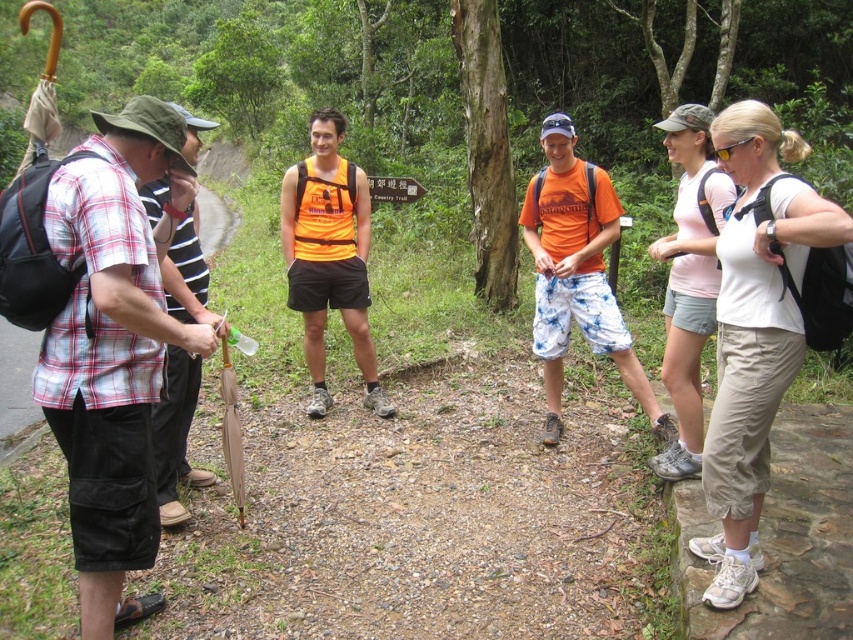
Which is more to the left, plaid cotton shirt at left or plaid fabric shirt at left?

plaid fabric shirt at left is more to the left.

Measure the distance from plaid cotton shirt at left to plaid fabric shirt at left.

29.06 inches

I want to click on plaid cotton shirt at left, so click(x=114, y=346).

This screenshot has width=853, height=640. In order to click on plaid cotton shirt at left in this screenshot , I will do `click(114, 346)`.

Locate an element on the screen. orange cotton shirt at center is located at coordinates (576, 273).

In the scene shown: Does orange cotton shirt at center appear on the left side of brown leather umbrella at lower left?

Incorrect, orange cotton shirt at center is not on the left side of brown leather umbrella at lower left.

Locate an element on the screen. This screenshot has height=640, width=853. orange cotton shirt at center is located at coordinates (576, 273).

Does orange cotton shirt at center have a larger size compared to pink fabric shorts at upper right?

Indeed, orange cotton shirt at center has a larger size compared to pink fabric shorts at upper right.

Can you confirm if orange cotton shirt at center is smaller than pink fabric shorts at upper right?

Actually, orange cotton shirt at center might be larger than pink fabric shorts at upper right.

Is point (550, 300) positioned behind point (706, 113)?

Yes.

This screenshot has width=853, height=640. Find the location of `orange cotton shirt at center`. orange cotton shirt at center is located at coordinates (576, 273).